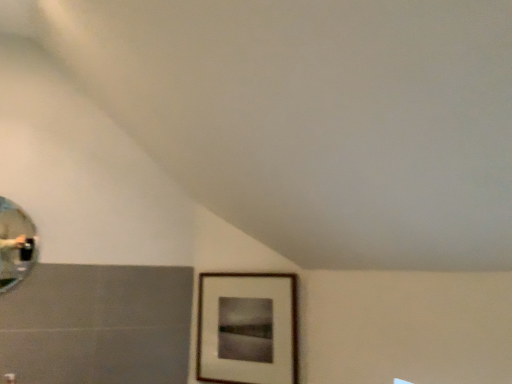
Question: Should I look upward or downward to see shiny silver mirror at left?

Choices:
 (A) up
 (B) down

Answer: (B)

Question: From the image's perspective, does wooden picture frame at lower right appear higher than shiny silver mirror at left?

Choices:
 (A) no
 (B) yes

Answer: (A)

Question: Is wooden picture frame at lower right smaller than shiny silver mirror at left?

Choices:
 (A) no
 (B) yes

Answer: (A)

Question: Is wooden picture frame at lower right outside shiny silver mirror at left?

Choices:
 (A) yes
 (B) no

Answer: (A)

Question: Is wooden picture frame at lower right far from shiny silver mirror at left?

Choices:
 (A) yes
 (B) no

Answer: (B)

Question: Can you confirm if wooden picture frame at lower right is wider than shiny silver mirror at left?

Choices:
 (A) no
 (B) yes

Answer: (B)

Question: Could you tell me if wooden picture frame at lower right is turned towards shiny silver mirror at left?

Choices:
 (A) yes
 (B) no

Answer: (B)

Question: Is shiny silver mirror at left oriented towards wooden picture frame at lower right?

Choices:
 (A) no
 (B) yes

Answer: (A)

Question: Considering the relative sizes of shiny silver mirror at left and wooden picture frame at lower right in the image provided, is shiny silver mirror at left taller than wooden picture frame at lower right?

Choices:
 (A) no
 (B) yes

Answer: (A)

Question: Can you confirm if shiny silver mirror at left is wider than wooden picture frame at lower right?

Choices:
 (A) yes
 (B) no

Answer: (B)

Question: Is shiny silver mirror at left positioned before wooden picture frame at lower right?

Choices:
 (A) no
 (B) yes

Answer: (B)

Question: Is shiny silver mirror at left surrounding wooden picture frame at lower right?

Choices:
 (A) yes
 (B) no

Answer: (B)

Question: Can we say shiny silver mirror at left lies outside wooden picture frame at lower right?

Choices:
 (A) no
 (B) yes

Answer: (B)

Question: Considering the positions of wooden picture frame at lower right and shiny silver mirror at left in the image, is wooden picture frame at lower right wider or thinner than shiny silver mirror at left?

Choices:
 (A) wide
 (B) thin

Answer: (A)